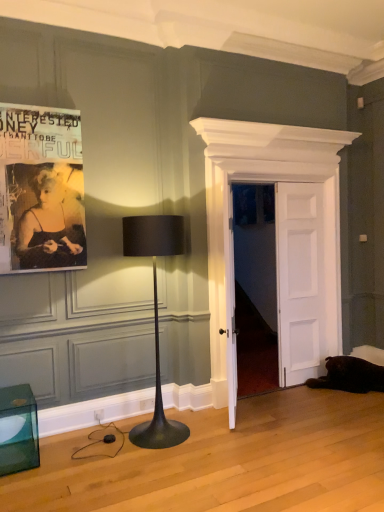
Question: Is transparent glass cube at lower left wider than white wooden door at center, which ranks as the second door in right-to-left order?

Choices:
 (A) no
 (B) yes

Answer: (B)

Question: From the image's perspective, is transparent glass cube at lower left beneath white wooden door at center, the first door when ordered from left to right?

Choices:
 (A) yes
 (B) no

Answer: (A)

Question: Is white wooden door at center, which ranks as the second door in right-to-left order, located within transparent glass cube at lower left?

Choices:
 (A) yes
 (B) no

Answer: (B)

Question: From the image's perspective, is transparent glass cube at lower left above white wooden door at center, the first door when ordered from left to right?

Choices:
 (A) yes
 (B) no

Answer: (B)

Question: Considering the relative sizes of transparent glass cube at lower left and white wooden door at center, the first door when ordered from left to right, in the image provided, is transparent glass cube at lower left thinner than white wooden door at center, the first door when ordered from left to right,?

Choices:
 (A) no
 (B) yes

Answer: (A)

Question: From their relative heights in the image, would you say transparent glass cube at lower left is taller or shorter than black paper poster at upper left?

Choices:
 (A) short
 (B) tall

Answer: (A)

Question: Is transparent glass cube at lower left in front of or behind black paper poster at upper left in the image?

Choices:
 (A) front
 (B) behind

Answer: (A)

Question: Which is correct: transparent glass cube at lower left is inside black paper poster at upper left, or outside of it?

Choices:
 (A) outside
 (B) inside

Answer: (A)

Question: From the image's perspective, is transparent glass cube at lower left located above or below black paper poster at upper left?

Choices:
 (A) above
 (B) below

Answer: (B)

Question: Choose the correct answer: Is white wooden door at center, which is the 2th door in left-to-right order, inside transparent glass cube at lower left or outside it?

Choices:
 (A) outside
 (B) inside

Answer: (A)

Question: Considering the relative positions of white wooden door at center, which is the 2th door in left-to-right order, and transparent glass cube at lower left in the image provided, is white wooden door at center, which is the 2th door in left-to-right order, to the left or to the right of transparent glass cube at lower left?

Choices:
 (A) right
 (B) left

Answer: (A)

Question: From a real-world perspective, is white wooden door at center, which is the 2th door in left-to-right order, physically located above or below transparent glass cube at lower left?

Choices:
 (A) above
 (B) below

Answer: (A)

Question: Does point (284, 239) appear closer or farther from the camera than point (11, 418)?

Choices:
 (A) closer
 (B) farther

Answer: (B)

Question: Would you say white wooden door at center, which is the 2th door in left-to-right order, is inside or outside white wooden door at center, the first door when ordered from left to right?

Choices:
 (A) outside
 (B) inside

Answer: (B)

Question: In the image, is white wooden door at center, which is the 2th door in left-to-right order, on the left side or the right side of white wooden door at center, which ranks as the second door in right-to-left order?

Choices:
 (A) left
 (B) right

Answer: (B)